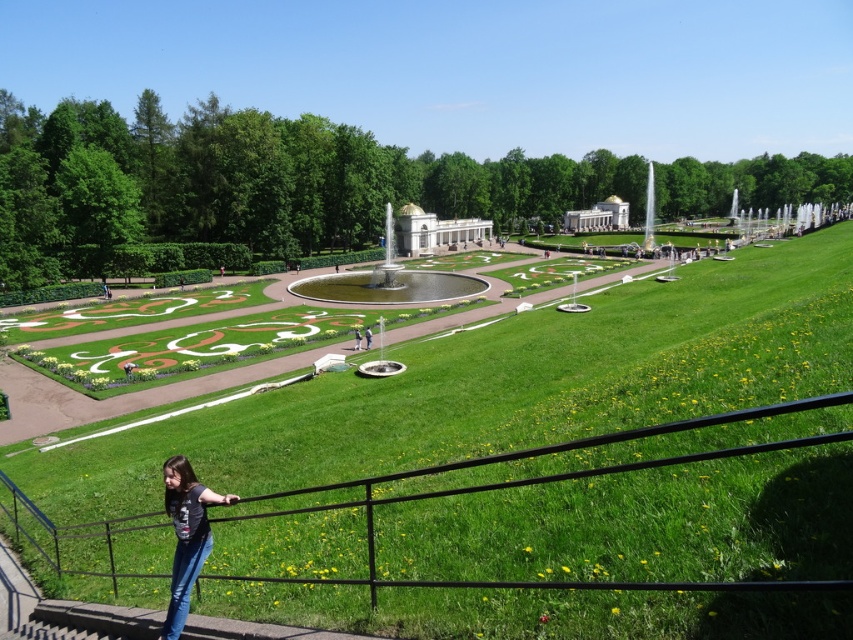
You are a drone operator who needs to land a drone on the green grass at center. The drone has a GPS coordinate system where the bottom left corner of the image is the origin point. The coordinates are given as a pair of values between 0 and 1, with the first number representing the horizontal axis and the second the vertical axis. According to the provided information, what are the coordinates where you should direct the drone to land?

The coordinates for the green grass at center are given as point (502, 387). Therefore, you should direct the drone to land at the coordinates 0.605 on the horizontal axis and 0.589 on the vertical axis.

You are standing in the garden and want to take a photo of both the denim jeans at lower left and the gold dome building at center. Which object should you focus on first to ensure both are in the frame?

You should focus on the denim jeans at lower left first because it is closer to you than the gold dome building at center, ensuring both are in the frame.

You are a drone operator trying to capture a photo of the garden. The camera is currently focused on the green grass at center. If you move the camera 0.05 units to the right and 0.05 units down from the current position, what will be the new coordinates of the camera focus?

The new coordinates will be calculated by adding 0.05 to the x and y values of the original position. The original coordinates are (502, 387). Adding 0.05 to each gives 0.655 and 0.639 respectively. Therefore, the new coordinates are (544, 419).